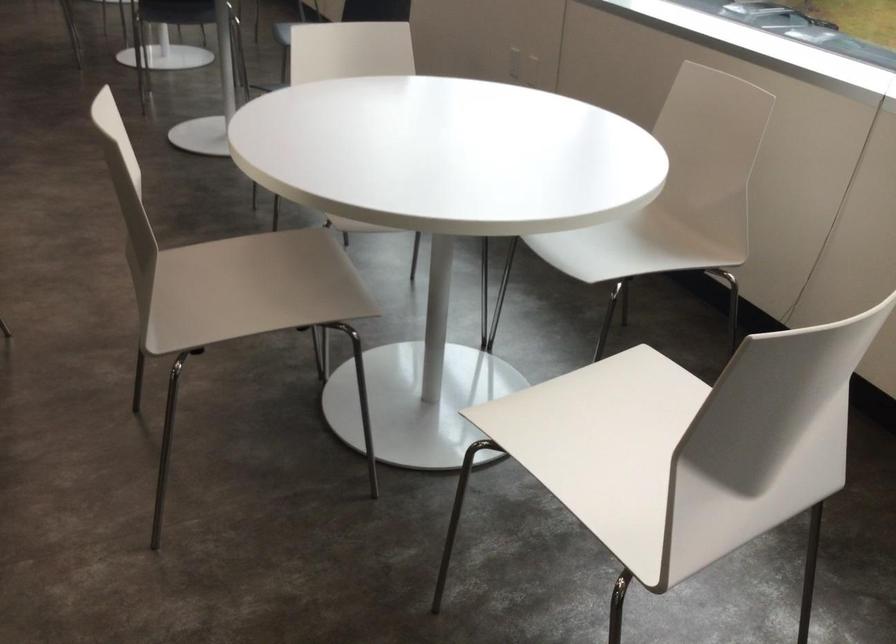
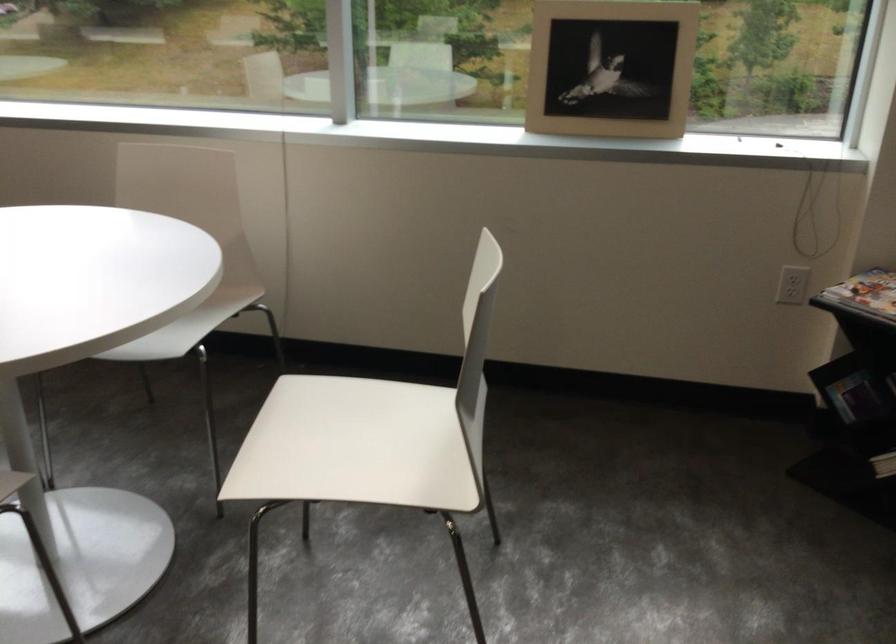
Question: I am providing you with two images of the same scene from different viewpoints. Please identify which objects are invisible in image2.

Choices:
 (A) stack of white paper
 (B) white chair sitting surface
 (C) magazine on rack
 (D) picture frame

Answer: (B)